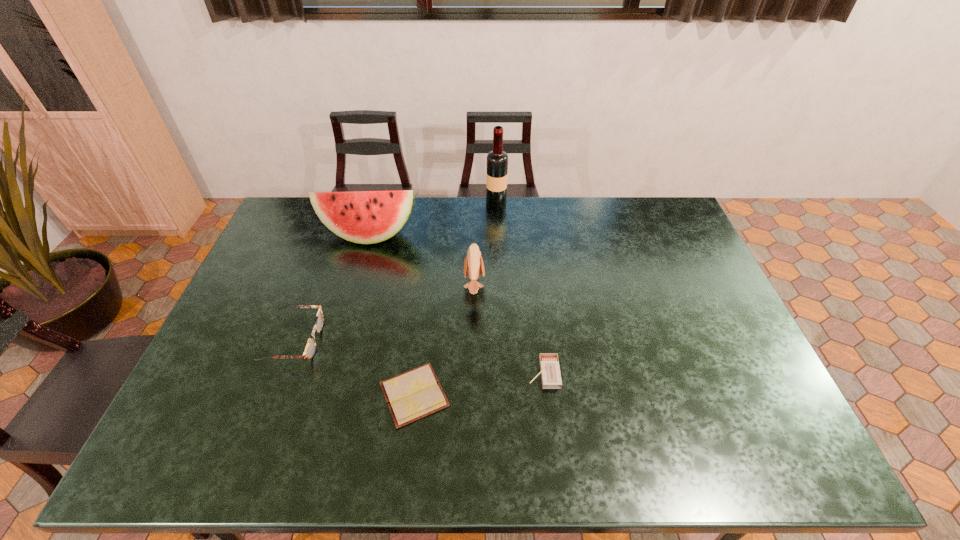
Locate an element on the screen. This screenshot has width=960, height=540. free spot that satisfies the following two spatial constraints: 1. on the outer rind of the watermelon; 2. on the left side of the shortest object is located at coordinates pos(324,395).

The height and width of the screenshot is (540, 960). I want to click on free region that satisfies the following two spatial constraints: 1. on the outer rind of the second farthest object; 2. on the left side of the shortest object, so click(324, 395).